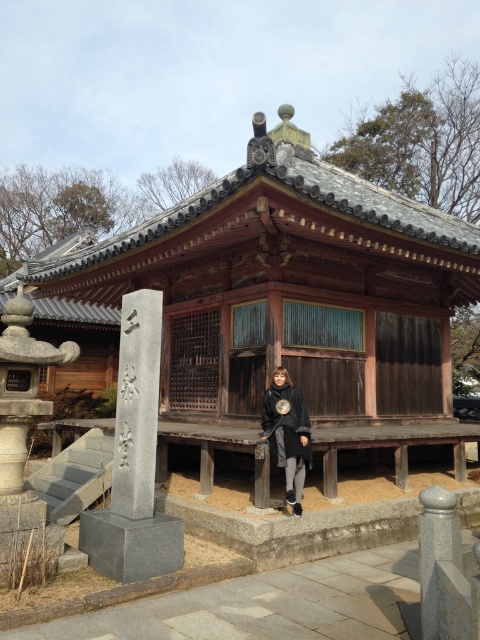
Describe the element at coordinates (286, 289) in the screenshot. The height and width of the screenshot is (640, 480). I see `wooden at center` at that location.

Is wooden at center to the left of gray stone pillar at left from the viewer's perspective?

Indeed, wooden at center is positioned on the left side of gray stone pillar at left.

Between point (283, 353) and point (129, 323), which one is positioned in front?

Positioned in front is point (129, 323).

Where is `wooden at center`? wooden at center is located at coordinates (286, 289).

Can you confirm if gray stone pillar at left is shorter than gray stone pillar at lower right?

Incorrect, gray stone pillar at left's height does not fall short of gray stone pillar at lower right's.

Between point (178, 548) and point (450, 536), which one is positioned behind?

The point (178, 548) is behind.

Does point (110, 509) come behind point (444, 506)?

Yes, point (110, 509) is farther from viewer.

Locate an element on the screen. This screenshot has width=480, height=640. gray stone pillar at left is located at coordinates (134, 460).

Is point (168, 236) farther from camera compared to point (275, 394)?

Yes, it is.

This screenshot has height=640, width=480. What do you see at coordinates (286, 289) in the screenshot?
I see `wooden at center` at bounding box center [286, 289].

Does point (466, 259) come farther from viewer compared to point (265, 410)?

Yes, it is.

You are a GUI agent. You are given a task and a screenshot of the screen. Output one action in this format:
    pyautogui.click(x=<x>, y=<y>)
    Task: Click on the wooden at center
    This screenshot has height=640, width=480.
    Given the screenshot: What is the action you would take?
    pyautogui.click(x=286, y=289)